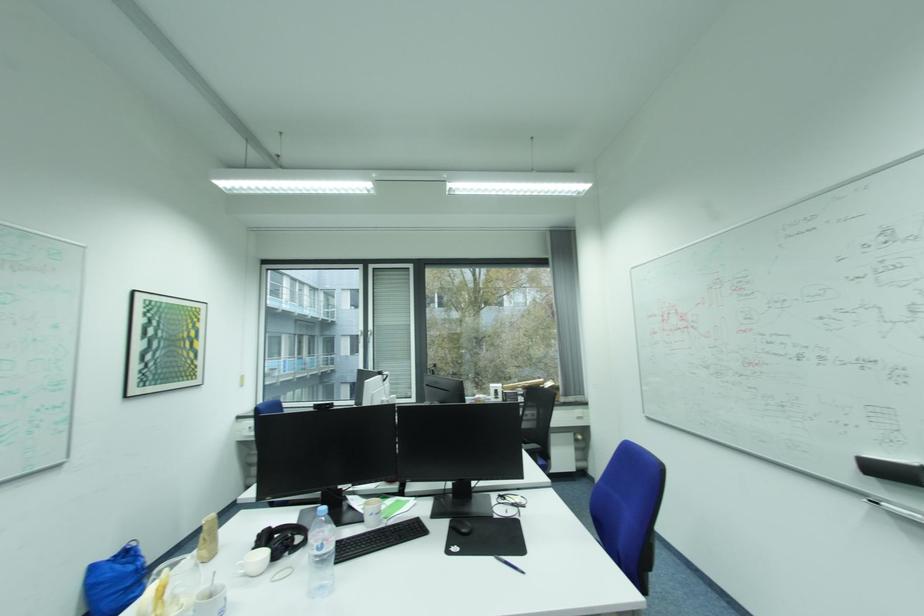
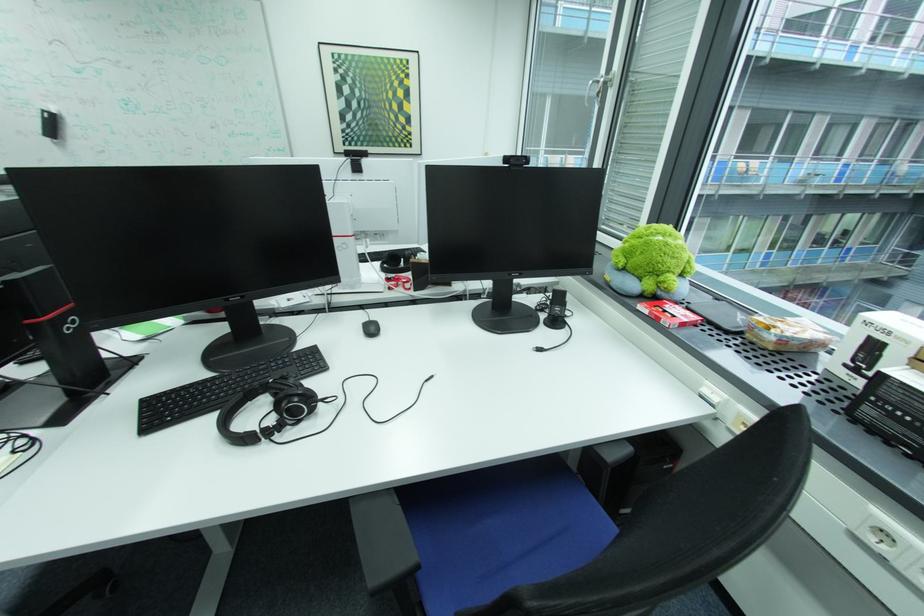
In the second image, find the point that corresponds to point (134, 398) in the first image.

(344, 153)